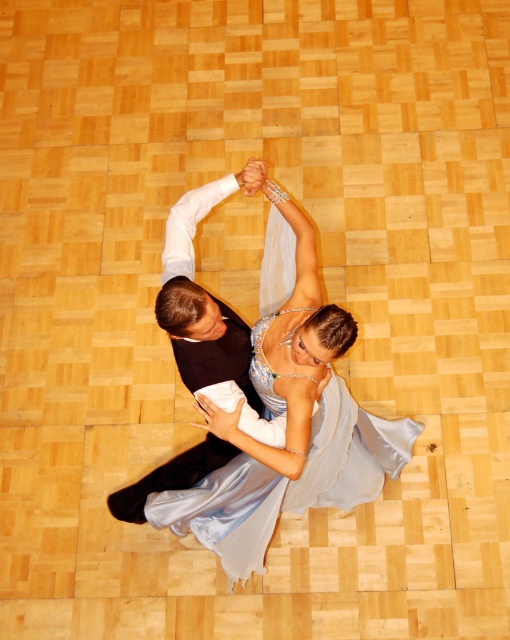
Question: Can you confirm if satin dress at center is positioned to the left of shiny black suit at center?

Choices:
 (A) no
 (B) yes

Answer: (A)

Question: Can you confirm if satin dress at center is smaller than shiny black suit at center?

Choices:
 (A) no
 (B) yes

Answer: (A)

Question: Does satin dress at center come in front of shiny black suit at center?

Choices:
 (A) yes
 (B) no

Answer: (A)